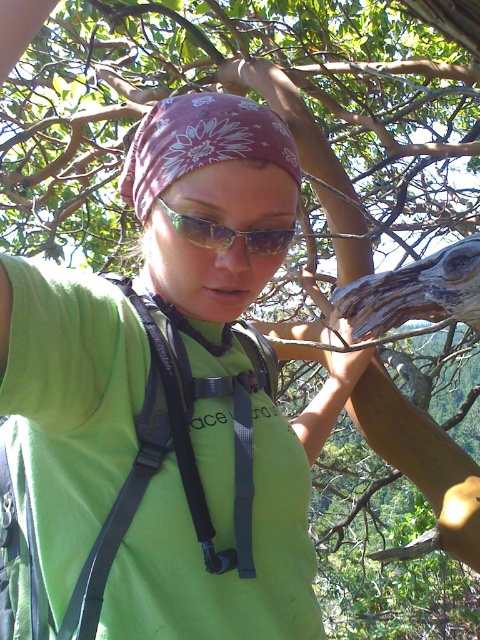
Question: In this image, where is black fabric strap at center located relative to purple floral bandana at center?

Choices:
 (A) left
 (B) right

Answer: (A)

Question: Which object is farther from the camera taking this photo?

Choices:
 (A) black fabric strap at center
 (B) purple floral bandana at center

Answer: (B)

Question: Observing the image, what is the correct spatial positioning of purple floral bandana at center in reference to green plastic goggles at center?

Choices:
 (A) left
 (B) right

Answer: (A)

Question: Which object is the closest to the green plastic goggles at center?

Choices:
 (A) purple floral bandana at center
 (B) black fabric strap at center

Answer: (A)

Question: Which point is closer to the camera?

Choices:
 (A) green plastic goggles at center
 (B) black fabric strap at center

Answer: (B)

Question: Can you confirm if black fabric strap at center is thinner than green plastic goggles at center?

Choices:
 (A) yes
 (B) no

Answer: (B)